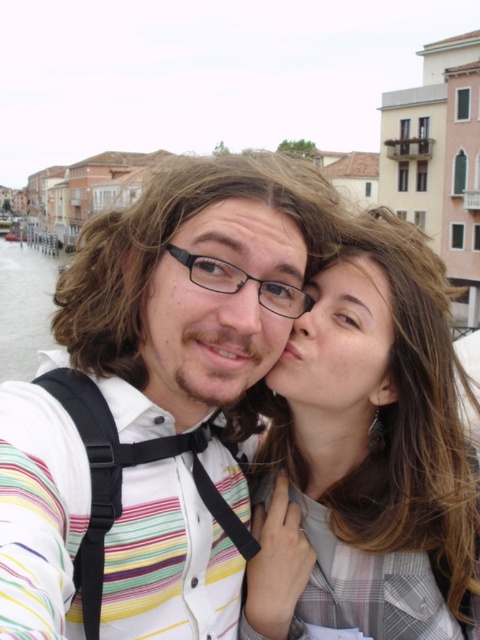
You are a photographer trying to capture a closeup of the matte black glasses at center and the black plastic glasses at center in the scene. Which glasses should you focus on first if you want to ensure both are in focus without adjusting the camera settings?

The matte black glasses at center is taller than the black plastic glasses at center, so you should focus on the matte black glasses at center first since it is farther away, allowing the black plastic glasses at center to remain in focus as well.

You are a photographer trying to capture a closeup of the matte black glasses at center and the black plastic glasses at center in the image. Since both are at the center, how can you determine which one is closer to the camera?

The matte black glasses at center is larger in size than the black plastic glasses at center, so the matte black glasses at center is closer to the camera because objects closer to the camera appear larger.